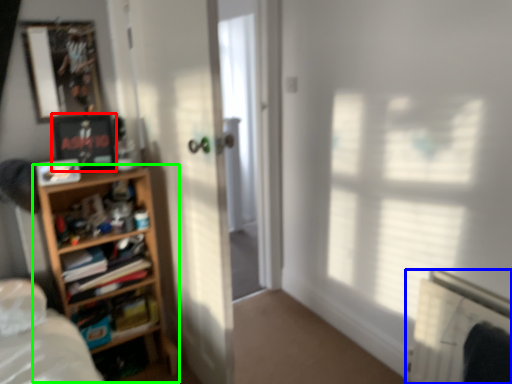
Question: Based on their relative distances, which object is farther from picture frame (highlighted by a red box)? Choose from radiator (highlighted by a blue box) and shelf (highlighted by a green box).

Choices:
 (A) radiator
 (B) shelf

Answer: (A)